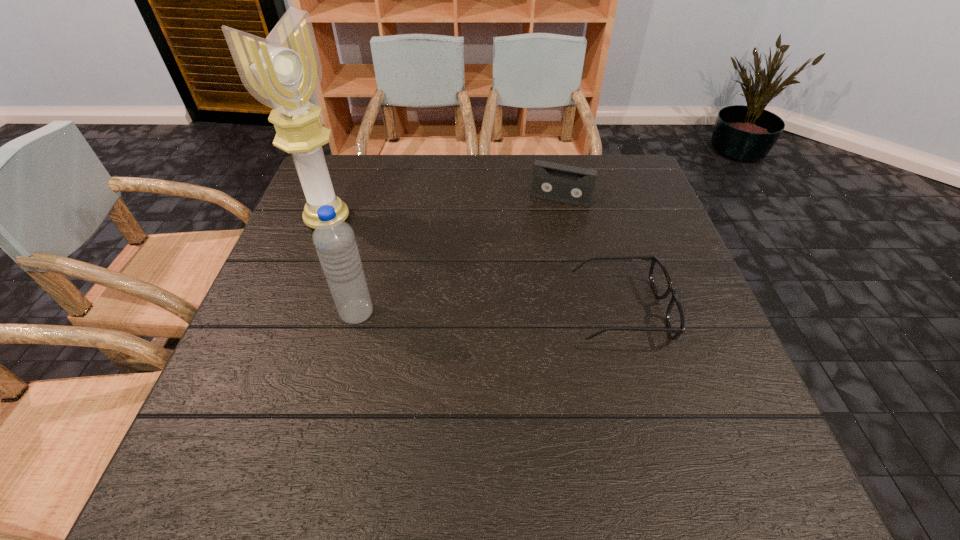
This screenshot has width=960, height=540. What are the coordinates of `vacant space on the desktop that is between the third shortest object and the spectacles and is positioned on the front-facing side of the third tallest object` in the screenshot? It's located at click(x=520, y=311).

Find the location of a particular element. The height and width of the screenshot is (540, 960). vacant spot on the desktop that is between the second tallest object and the spectacles and is positioned on the front-facing side of the tallest object is located at coordinates (482, 312).